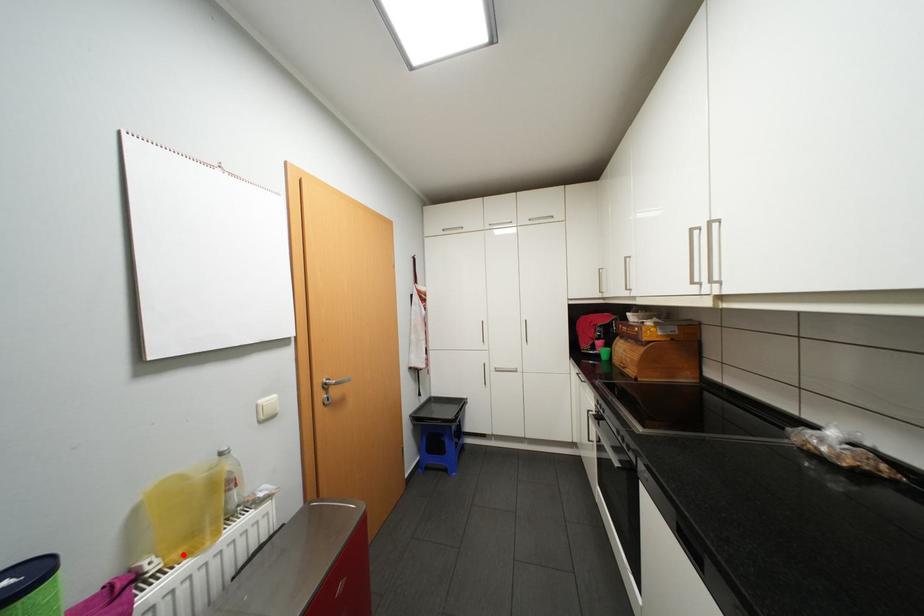
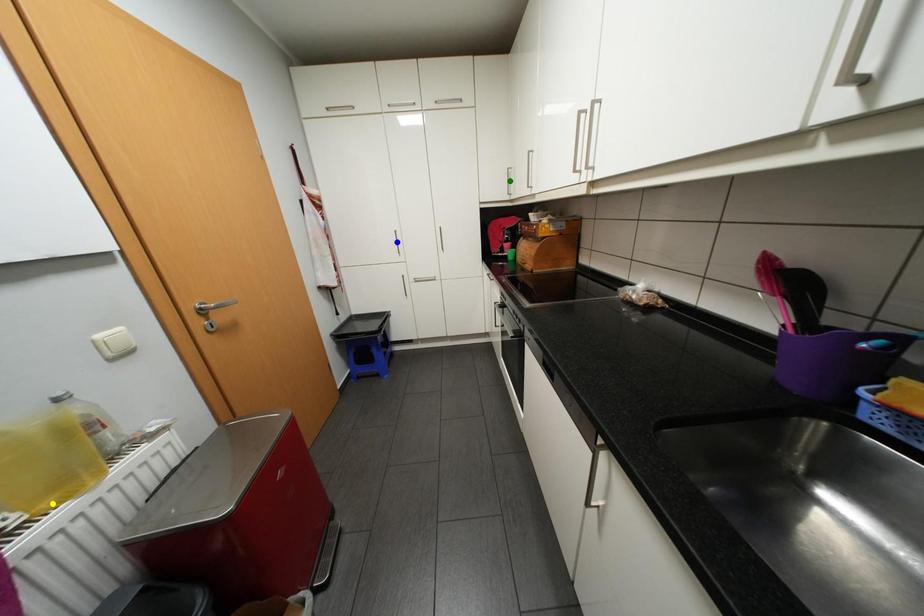
Question: I am providing you with two images of the same scene from different viewpoints. A red point is marked on the first image. You are given multiple points on the second image. Which point in image 2 represents the same 3d spot as the red point in image 1?

Choices:
 (A) green point
 (B) yellow point
 (C) blue point

Answer: (B)